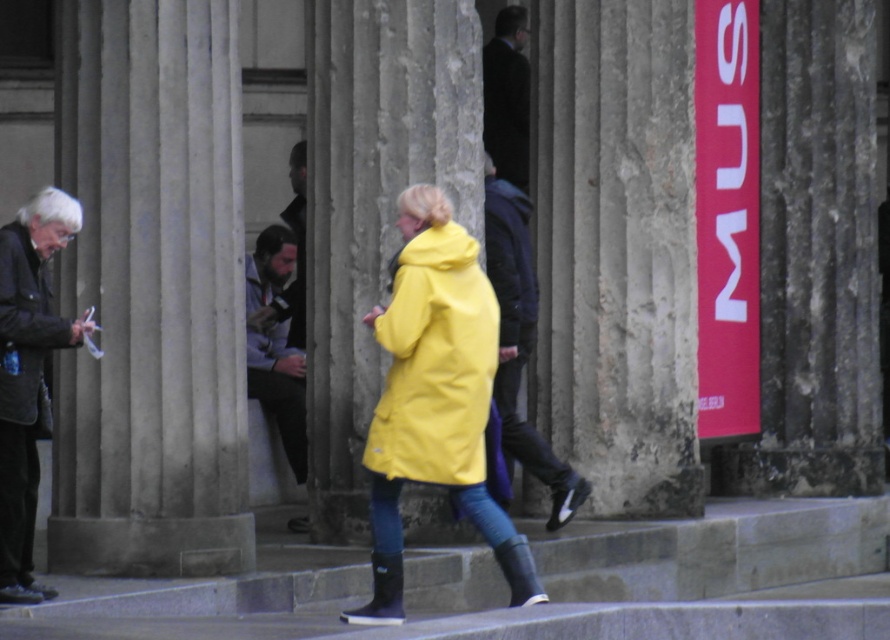
Who is more distant from viewer, (142, 83) or (386, 609)?

The point (142, 83) is more distant.

Image resolution: width=890 pixels, height=640 pixels. I want to click on smooth concrete pillar at left, so click(x=152, y=292).

Who is lower down, yellow matte jacket at center or light blue fabric shirt at center?

light blue fabric shirt at center

Does point (409, 294) come closer to viewer compared to point (277, 369)?

Yes, it is in front of point (277, 369).

In order to click on yellow matte jacket at center in this screenshot , I will do `click(435, 362)`.

Between point (303, 358) and point (298, 282), which one is positioned in front?

Positioned in front is point (303, 358).

From the picture: Does light blue fabric shirt at center appear on the left side of dark brown leather jacket at center?

Indeed, light blue fabric shirt at center is positioned on the left side of dark brown leather jacket at center.

Which is behind, point (302, 352) or point (290, 179)?

Point (290, 179)

Find the location of a particular element. light blue fabric shirt at center is located at coordinates (274, 346).